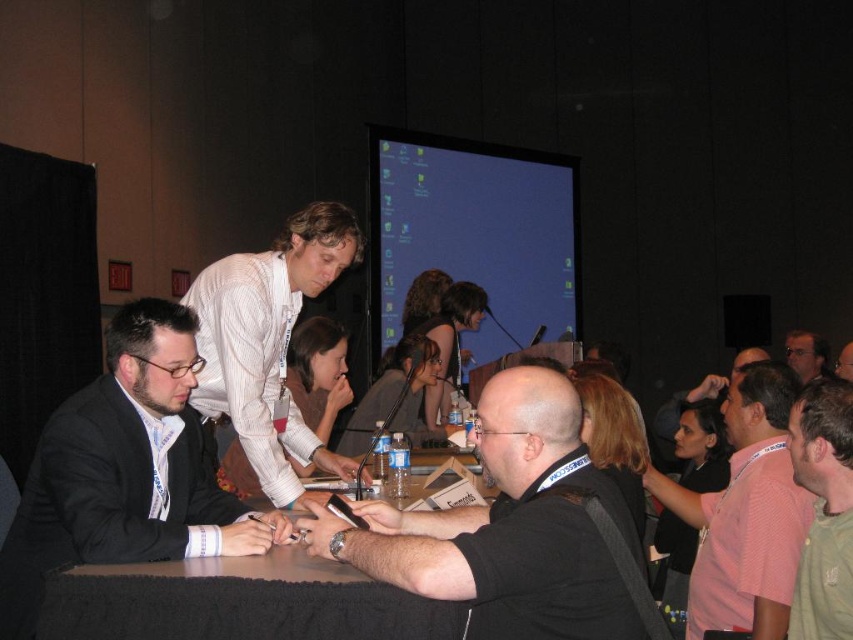
This screenshot has height=640, width=853. Describe the element at coordinates (509, 528) in the screenshot. I see `black matte shirt at center` at that location.

Is point (456, 560) farther from viewer compared to point (799, 372)?

No.

Identify the location of black matte shirt at center. This screenshot has height=640, width=853. (509, 528).

Is black matte suit at left taller than smooth white table at center?

Yes.

How distant is black matte suit at left from smooth white table at center?

10.02 inches

Where is `black matte suit at left`? This screenshot has width=853, height=640. black matte suit at left is located at coordinates (125, 472).

Who is taller, blue glossy projection screen at upper center or pink cotton shirt at right?

With more height is blue glossy projection screen at upper center.

Describe the element at coordinates (473, 234) in the screenshot. I see `blue glossy projection screen at upper center` at that location.

Image resolution: width=853 pixels, height=640 pixels. What are the coordinates of `blue glossy projection screen at upper center` in the screenshot? It's located at (473, 234).